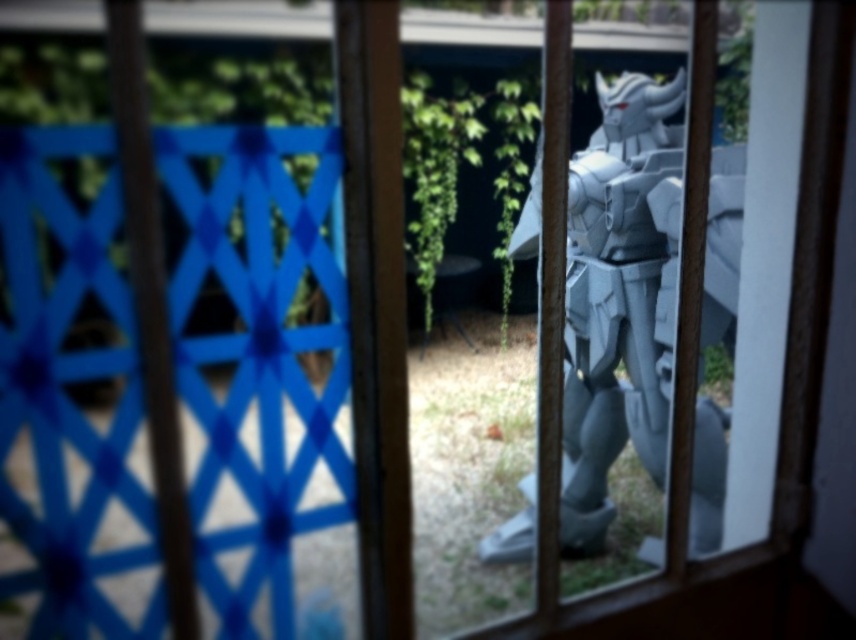
Question: Is blue lattice fence at left further to camera compared to gray metallic armor at center?

Choices:
 (A) no
 (B) yes

Answer: (B)

Question: Does blue lattice fence at left have a smaller size compared to gray metallic armor at center?

Choices:
 (A) no
 (B) yes

Answer: (A)

Question: Which point is closer to the camera?

Choices:
 (A) gray metallic armor at center
 (B) blue lattice fence at left

Answer: (A)

Question: Which point appears farthest from the camera in this image?

Choices:
 (A) (699, 476)
 (B) (251, 404)

Answer: (B)

Question: Can you confirm if blue lattice fence at left is thinner than gray metallic armor at center?

Choices:
 (A) no
 (B) yes

Answer: (A)